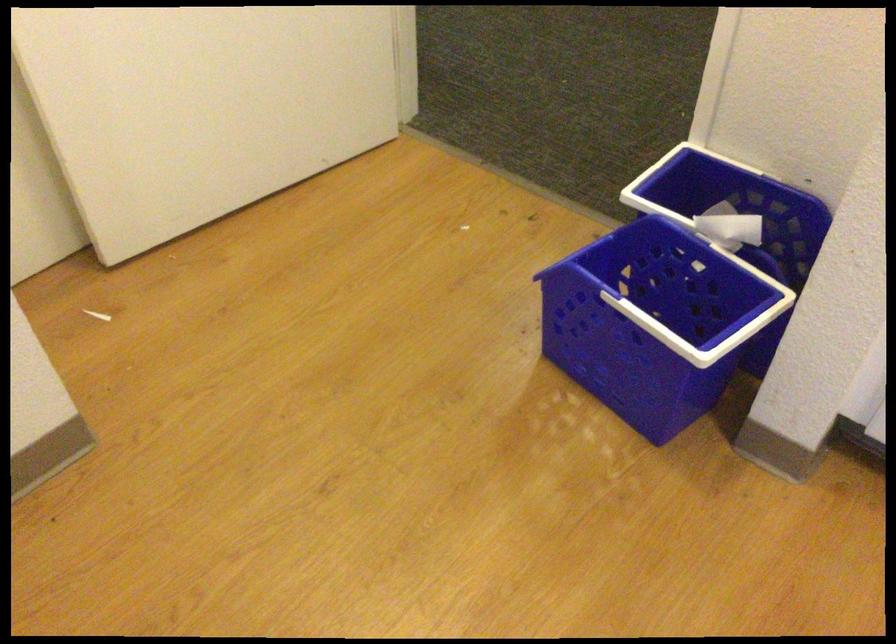
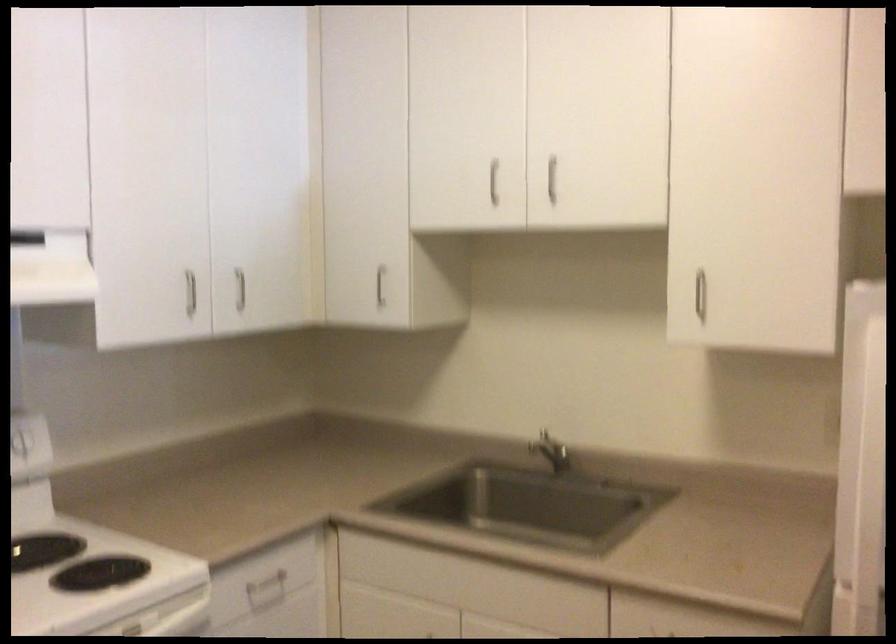
Based on the continuous images, in which direction is the camera rotating?

The camera rotated toward right-down.